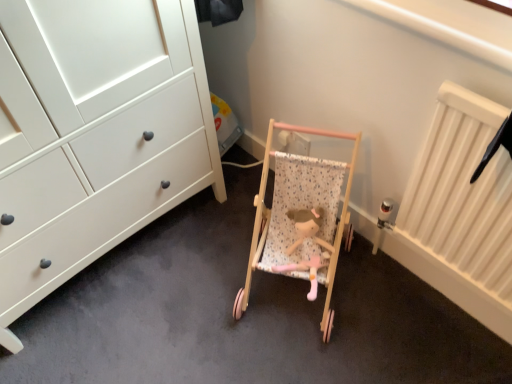
Where is `free location to the right of wooden stroller at center`? The width and height of the screenshot is (512, 384). free location to the right of wooden stroller at center is located at coordinates (392, 302).